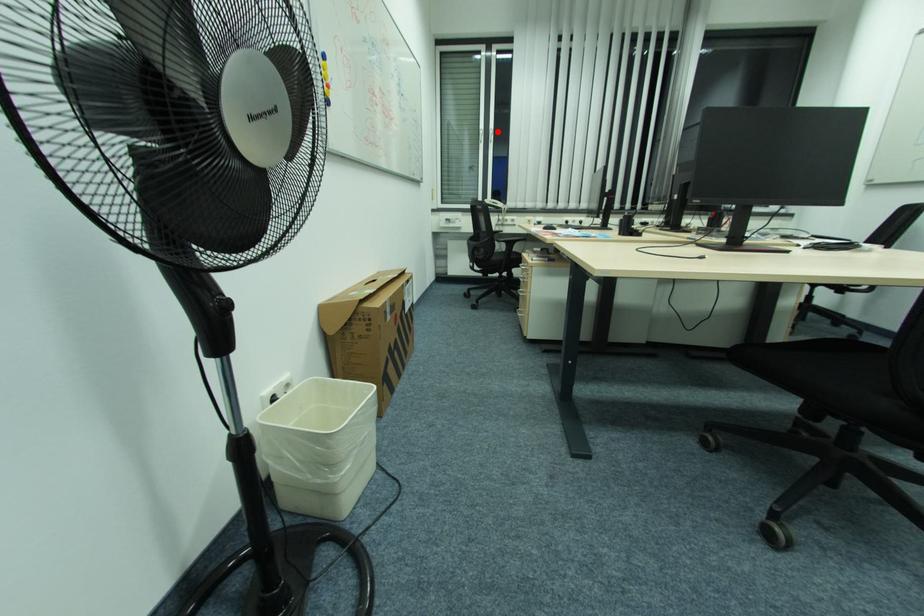
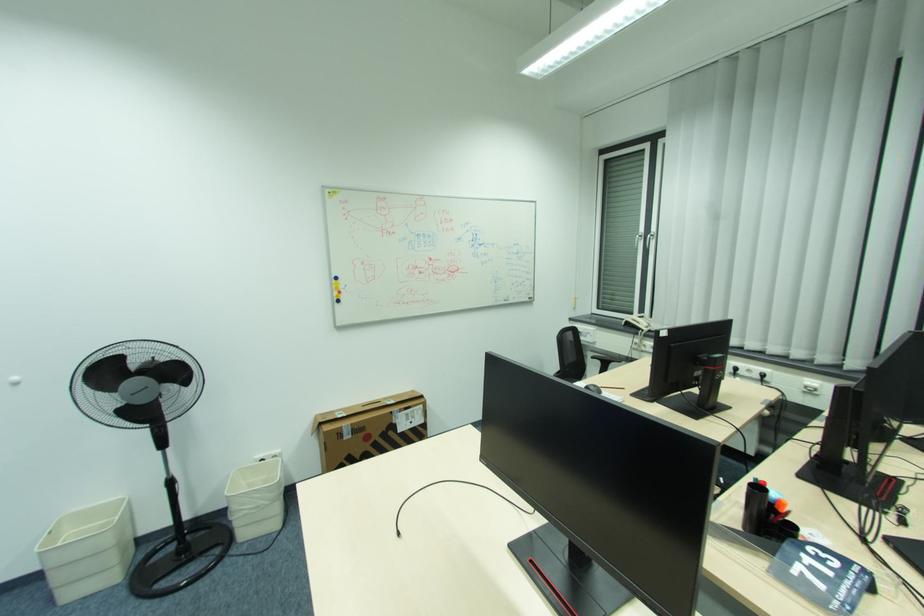
Find the pixel in the second image that matches the highlighted location in the first image.

(653, 236)